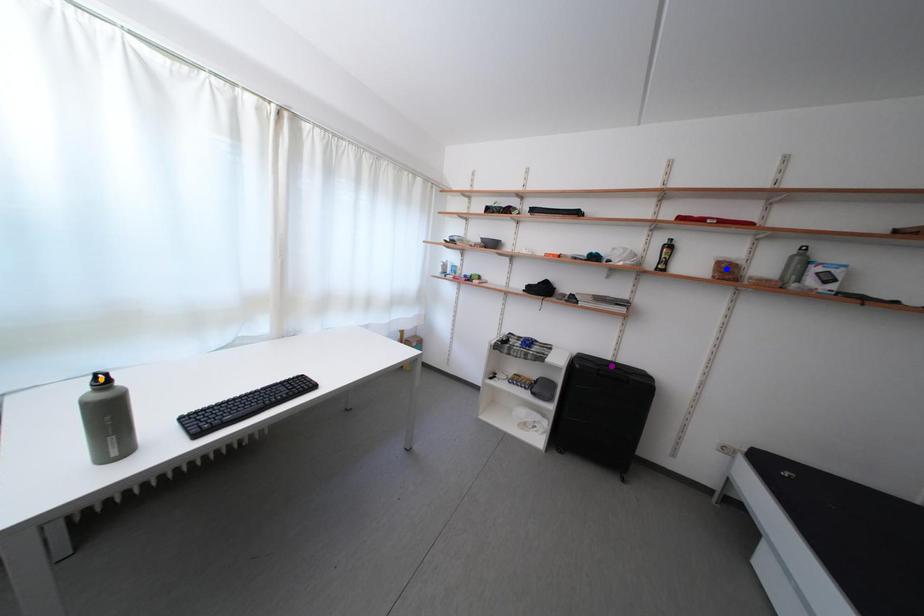
Order these from nearest to farthest:
A) orange point
B) purple point
C) blue point

orange point → blue point → purple point